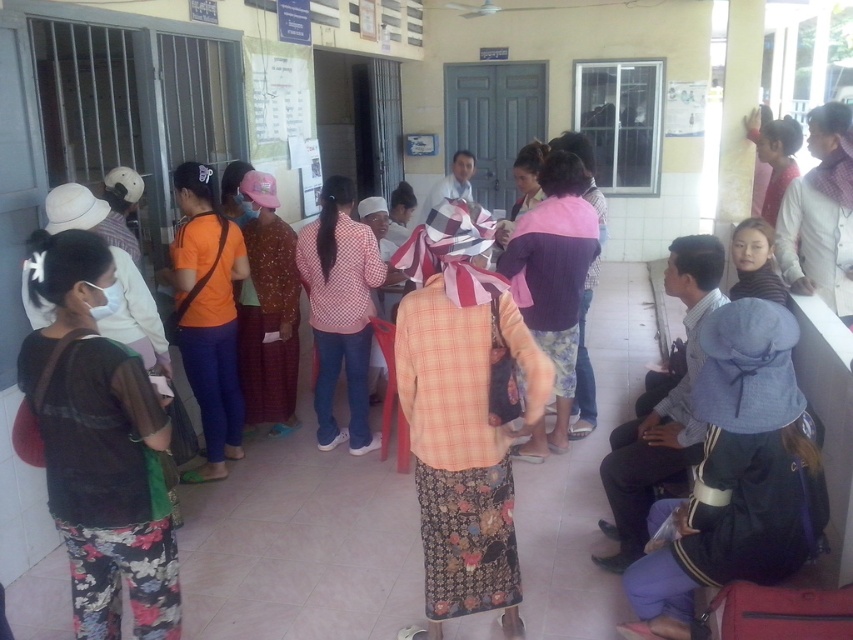
Does plaid fabric shirt at center have a lesser width compared to pink fabric at center?

No, plaid fabric shirt at center is not thinner than pink fabric at center.

In the scene shown: Does plaid fabric shirt at center have a larger size compared to pink fabric at center?

Yes.

Locate an element on the screen. The image size is (853, 640). plaid fabric shirt at center is located at coordinates (463, 413).

Can you confirm if black sheer blouse at left is positioned above orange fabric shirt at center?

No, black sheer blouse at left is not above orange fabric shirt at center.

Which is more to the left, black sheer blouse at left or orange fabric shirt at center?

orange fabric shirt at center is more to the left.

Does point (88, 317) come in front of point (229, 385)?

Yes, point (88, 317) is in front of point (229, 385).

At what (x,y) coordinates should I click in order to perform the action: click on black sheer blouse at left. Please return your answer as a coordinate pair (x, y). Looking at the image, I should click on (99, 445).

Measure the distance between plaid fabric shirt at center and pink fabric headscarf at center.

The distance of plaid fabric shirt at center from pink fabric headscarf at center is 2.82 meters.

Where is `plaid fabric shirt at center`? The height and width of the screenshot is (640, 853). plaid fabric shirt at center is located at coordinates (463, 413).

Is point (508, 387) positioned in front of point (399, 180)?

Yes, point (508, 387) is in front of point (399, 180).

Locate an element on the screen. plaid fabric shirt at center is located at coordinates (463, 413).